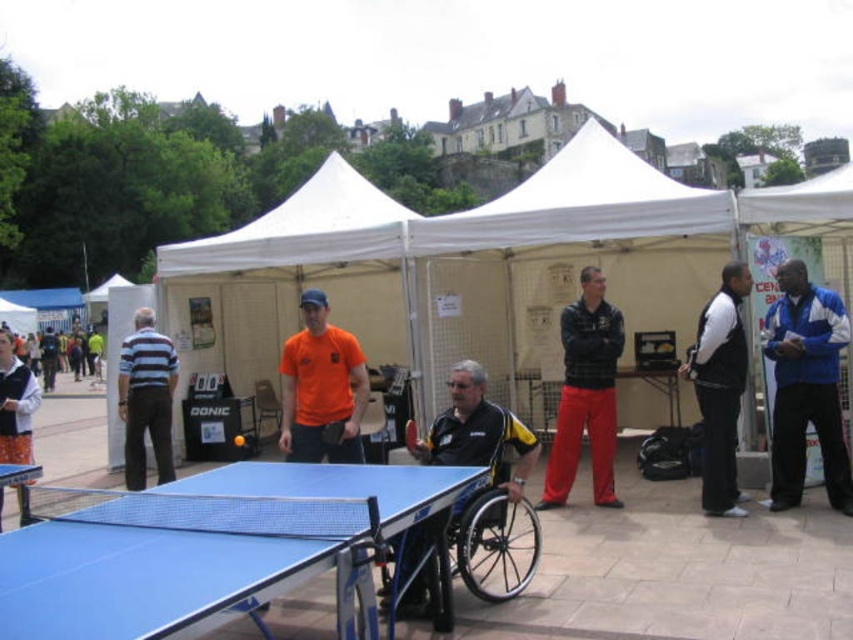
Question: Which of the following is the closest to the observer?

Choices:
 (A) striped cotton shirt at left
 (B) orange matte shirt at center

Answer: (B)

Question: Which is nearer to the black fleece jacket at right?

Choices:
 (A) orange fabric pants at lower left
 (B) black plastic wheelchair at center
 (C) orange matte shirt at center
 (D) blue plastic ping pong table at lower left

Answer: (B)

Question: Is blue plastic table at lower left thinner than black plastic wheelchair at center?

Choices:
 (A) no
 (B) yes

Answer: (A)

Question: Which point is farther to the camera?

Choices:
 (A) black leather jacket at center
 (B) orange matte shirt at center
 (C) blue/white jacket at right
 (D) blue plastic table tennis table at center

Answer: (A)

Question: Is blue plastic table at lower left smaller than black plastic wheelchair at center?

Choices:
 (A) yes
 (B) no

Answer: (B)

Question: Is blue/white jacket at right closer to camera compared to striped cotton shirt at left?

Choices:
 (A) no
 (B) yes

Answer: (B)